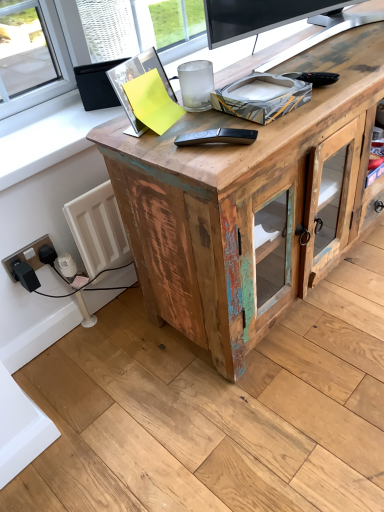
Question: Considering the relative sizes of weathered wood desk at center and black plastic socket at lower left in the image provided, is weathered wood desk at center thinner than black plastic socket at lower left?

Choices:
 (A) yes
 (B) no

Answer: (B)

Question: From a real-world perspective, is weathered wood desk at center beneath black plastic socket at lower left?

Choices:
 (A) yes
 (B) no

Answer: (B)

Question: From the image's perspective, is weathered wood desk at center beneath black plastic socket at lower left?

Choices:
 (A) yes
 (B) no

Answer: (B)

Question: Does weathered wood desk at center touch black plastic socket at lower left?

Choices:
 (A) no
 (B) yes

Answer: (A)

Question: Does weathered wood desk at center have a larger size compared to black plastic socket at lower left?

Choices:
 (A) yes
 (B) no

Answer: (A)

Question: Can you confirm if weathered wood desk at center is smaller than black plastic socket at lower left?

Choices:
 (A) no
 (B) yes

Answer: (A)

Question: Does weathered wood desk at center have a lesser width compared to black plastic remote control at center?

Choices:
 (A) no
 (B) yes

Answer: (A)

Question: Can you confirm if weathered wood desk at center is positioned to the left of black plastic remote control at center?

Choices:
 (A) yes
 (B) no

Answer: (B)

Question: Is weathered wood desk at center bigger than black plastic remote control at center?

Choices:
 (A) no
 (B) yes

Answer: (B)

Question: From the image's perspective, is weathered wood desk at center beneath black plastic remote control at center?

Choices:
 (A) yes
 (B) no

Answer: (B)

Question: Considering the relative sizes of weathered wood desk at center and black plastic remote control at center in the image provided, is weathered wood desk at center smaller than black plastic remote control at center?

Choices:
 (A) no
 (B) yes

Answer: (A)

Question: Is weathered wood desk at center wider than black plastic remote control at center?

Choices:
 (A) yes
 (B) no

Answer: (A)

Question: From the image's perspective, is black plastic remote control at center below weathered wood desk at center?

Choices:
 (A) no
 (B) yes

Answer: (B)